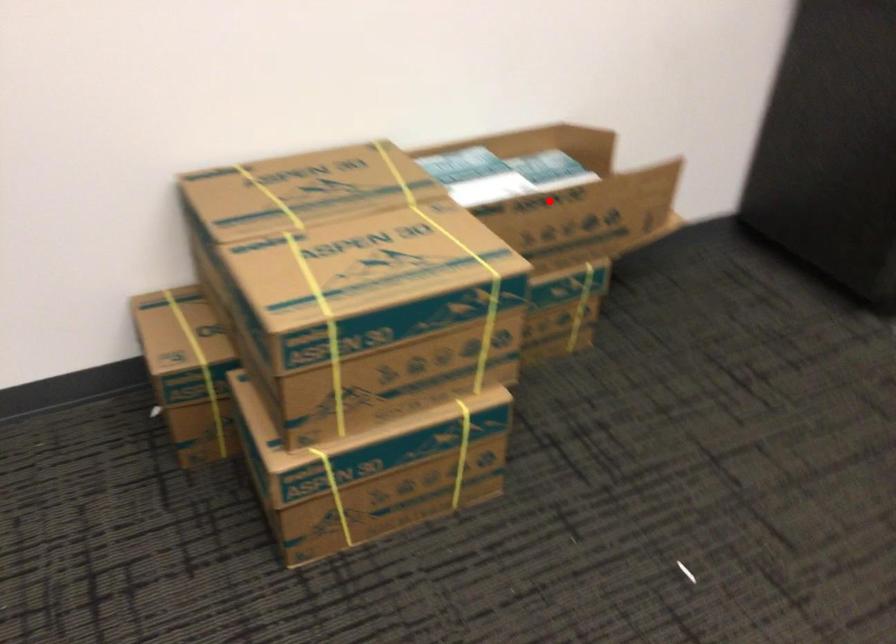
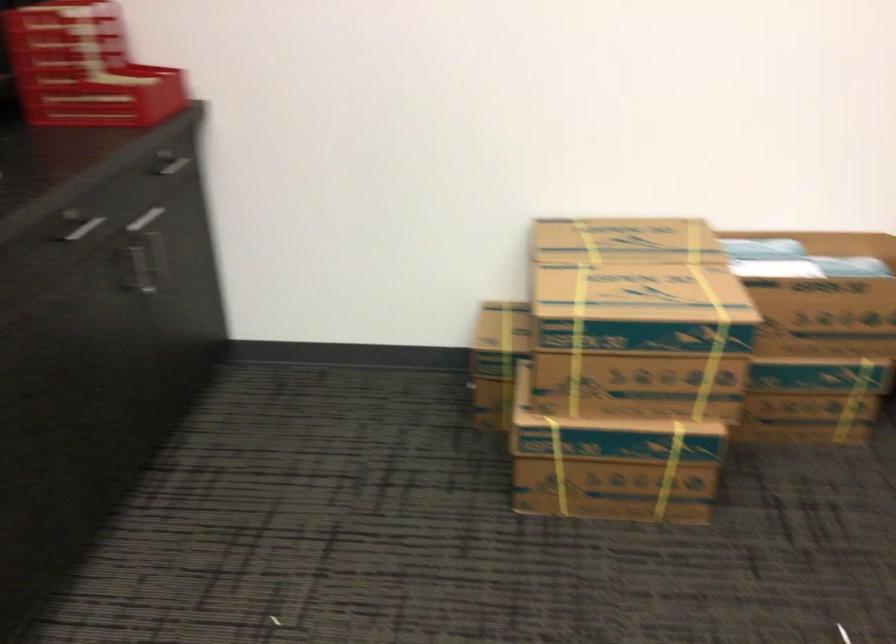
Find the pixel in the second image that matches the highlighted location in the first image.

(828, 286)